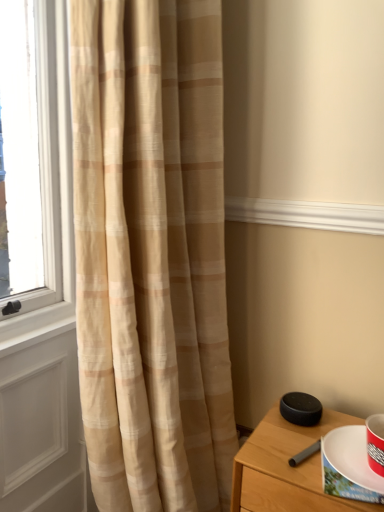
What is the approximate width of beige textured curtain at left?

22.45 inches.

I want to click on white paper plate at lower right, so click(x=351, y=456).

Image resolution: width=384 pixels, height=512 pixels. I want to click on beige textured curtain at left, so click(x=151, y=253).

Is white paper plate at lower right oriented away from beige textured curtain at left?

No, white paper plate at lower right is not facing the opposite direction of beige textured curtain at left.

Would you consider white paper plate at lower right to be distant from beige textured curtain at left?

white paper plate at lower right is actually quite close to beige textured curtain at left.

Based on the photo, from a real-world perspective, is white paper plate at lower right positioned over beige textured curtain at left based on gravity?

No, from a real-world perspective, white paper plate at lower right is not above beige textured curtain at left.

Looking at this image, which is behind, white paper plate at lower right or beige textured curtain at left?

Positioned behind is white paper plate at lower right.

Considering the relative positions of beige textured curtain at left and translucent beige curtain at left in the image provided, is beige textured curtain at left to the right of translucent beige curtain at left from the viewer's perspective?

Indeed, beige textured curtain at left is positioned on the right side of translucent beige curtain at left.

Locate an element on the screen. curtain located above the translucent beige curtain at left (from the image's perspective) is located at coordinates (151, 253).

Could you tell me if beige textured curtain at left is facing translucent beige curtain at left?

Yes, beige textured curtain at left is facing translucent beige curtain at left.

Find the location of `screen door on the left of beige textured curtain at left`. screen door on the left of beige textured curtain at left is located at coordinates (42, 429).

Can you confirm if translucent beige curtain at left is positioned to the right of beige textured curtain at left?

In fact, translucent beige curtain at left is to the left of beige textured curtain at left.

Considering the relative positions of translucent beige curtain at left and beige textured curtain at left in the image provided, is translucent beige curtain at left in front of beige textured curtain at left?

No, it is not.

Which is behind, point (27, 456) or point (339, 433)?

Positioned behind is point (27, 456).

Is translucent beige curtain at left facing towards white paper plate at lower right?

Yes, translucent beige curtain at left is turned towards white paper plate at lower right.

You are a GUI agent. You are given a task and a screenshot of the screen. Output one action in this format:
    pyautogui.click(x=<x>, y=<y>)
    Task: Click on the screen door that is below the white paper plate at lower right (from the image's perspective)
    This screenshot has height=512, width=384.
    Given the screenshot: What is the action you would take?
    pyautogui.click(x=42, y=429)

Is translucent beige curtain at left taller than white paper plate at lower right?

Correct, translucent beige curtain at left is much taller as white paper plate at lower right.

From a real-world perspective, is white paper plate at lower right above or below black matte speaker at lower right?

Clearly, from a real-world perspective, white paper plate at lower right is above black matte speaker at lower right.

Is black matte speaker at lower right surrounded by white paper plate at lower right?

That's incorrect, black matte speaker at lower right is not inside white paper plate at lower right.

From the image's perspective, is white paper plate at lower right beneath black matte speaker at lower right?

Incorrect, from the image's perspective, white paper plate at lower right is higher than black matte speaker at lower right.

Considering the positions of objects white paper plate at lower right and black matte speaker at lower right in the image provided, who is more to the left, white paper plate at lower right or black matte speaker at lower right?

Positioned to the left is black matte speaker at lower right.

Is beige textured curtain at left positioned far away from black matte speaker at lower right?

No.

Consider the image. Is beige textured curtain at left thinner than black matte speaker at lower right?

Incorrect, the width of beige textured curtain at left is not less than that of black matte speaker at lower right.

From the picture: Which is more to the left, beige textured curtain at left or black matte speaker at lower right?

Positioned to the left is beige textured curtain at left.

Is black matte speaker at lower right positioned before translucent beige curtain at left?

Yes, it is.

Is black matte speaker at lower right looking in the opposite direction of translucent beige curtain at left?

No.

Is point (260, 498) more distant than point (8, 432)?

No, (260, 498) is in front of (8, 432).

At what (x,y) coordinates should I click in order to perform the action: click on screen door behind the black matte speaker at lower right. Please return your answer as a coordinate pair (x, y). Image resolution: width=384 pixels, height=512 pixels. Looking at the image, I should click on (42, 429).

Find the location of a particular element. The image size is (384, 512). curtain lying above the white paper plate at lower right (from the image's perspective) is located at coordinates (151, 253).

At what (x,y) coordinates should I click in order to perform the action: click on screen door below the beige textured curtain at left (from the image's perspective). Please return your answer as a coordinate pair (x, y). This screenshot has width=384, height=512. Looking at the image, I should click on (42, 429).

Considering their positions, is translucent beige curtain at left positioned further to beige textured curtain at left than black matte speaker at lower right?

black matte speaker at lower right is further to beige textured curtain at left.

Considering their positions, is white paper plate at lower right positioned further to black matte speaker at lower right than translucent beige curtain at left?

translucent beige curtain at left is positioned further to the anchor black matte speaker at lower right.

Considering their positions, is black matte speaker at lower right positioned closer to translucent beige curtain at left than beige textured curtain at left?

beige textured curtain at left is closer to translucent beige curtain at left.

From the image, which object appears to be farther from white paper plate at lower right, black matte speaker at lower right or beige textured curtain at left?

beige textured curtain at left is positioned further to the anchor white paper plate at lower right.

Which object lies nearer to the anchor point white paper plate at lower right, beige textured curtain at left or black matte speaker at lower right?

black matte speaker at lower right is positioned closer to the anchor white paper plate at lower right.

Looking at the image, which one is located closer to black matte speaker at lower right, beige textured curtain at left or translucent beige curtain at left?

The object closer to black matte speaker at lower right is beige textured curtain at left.

Looking at the image, which one is located further to translucent beige curtain at left, beige textured curtain at left or black matte speaker at lower right?

black matte speaker at lower right is further to translucent beige curtain at left.

Looking at the image, which one is located further to translucent beige curtain at left, beige textured curtain at left or white paper plate at lower right?

white paper plate at lower right lies further to translucent beige curtain at left than the other object.

Identify the location of nightstand between beige textured curtain at left and white paper plate at lower right in the horizontal direction. The width and height of the screenshot is (384, 512). (287, 468).

I want to click on curtain between translucent beige curtain at left and black matte speaker at lower right from left to right, so pyautogui.click(x=151, y=253).

Where is `curtain between translucent beige curtain at left and white paper plate at lower right from left to right`? Image resolution: width=384 pixels, height=512 pixels. curtain between translucent beige curtain at left and white paper plate at lower right from left to right is located at coordinates (151, 253).

Find the location of a particular element. nightstand between translucent beige curtain at left and white paper plate at lower right is located at coordinates (287, 468).